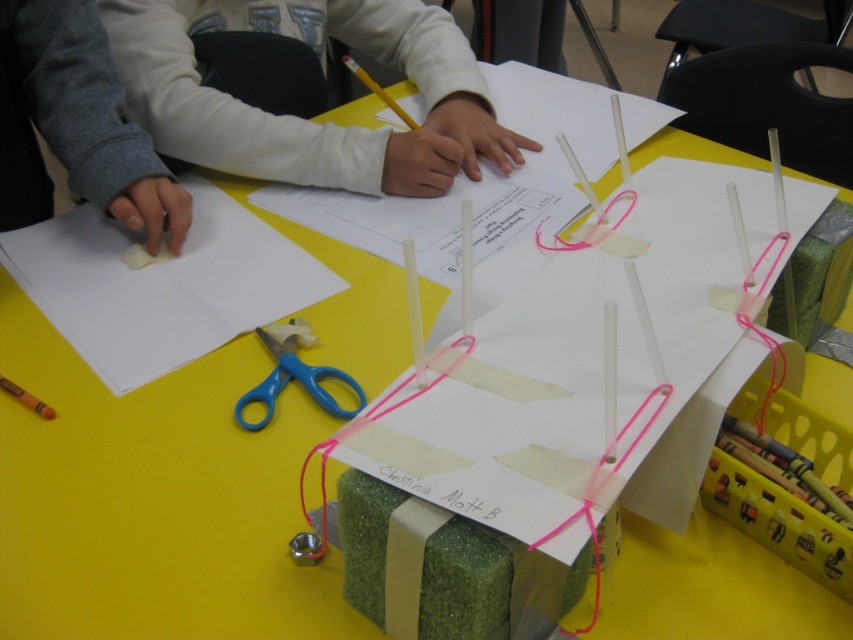
Question: Is white paper at left closer to the viewer compared to white paper at center?

Choices:
 (A) no
 (B) yes

Answer: (B)

Question: Which of the following is the farthest from the observer?

Choices:
 (A) blue plastic scissors at center
 (B) white paper at center

Answer: (B)

Question: Does white paper at center lie in front of blue plastic scissors at center?

Choices:
 (A) no
 (B) yes

Answer: (A)

Question: Can you confirm if green matte foam at center is thinner than white paper at left?

Choices:
 (A) yes
 (B) no

Answer: (B)

Question: Which of these objects is positioned farthest from the green matte foam at center?

Choices:
 (A) blue plastic scissors at center
 (B) white paper at left

Answer: (B)

Question: Estimate the real-world distances between objects in this image. Which object is farther from the blue plastic scissors at center?

Choices:
 (A) green matte foam at center
 (B) white paper at center

Answer: (B)